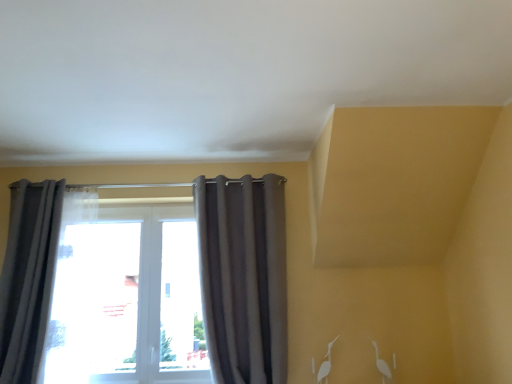
Question: Would you say matte gray curtain at center, arranged as the 1th curtain when viewed from the right, is inside or outside gray fabric curtain at left, which is counted as the second curtain, starting from the right?

Choices:
 (A) inside
 (B) outside

Answer: (B)

Question: Is matte gray curtain at center, arranged as the 1th curtain when viewed from the right, bigger or smaller than gray fabric curtain at left, which is counted as the second curtain, starting from the right?

Choices:
 (A) big
 (B) small

Answer: (B)

Question: Is matte gray curtain at center, placed as the second curtain when sorted from left to right, in front of or behind gray fabric curtain at left, which is counted as the second curtain, starting from the right, in the image?

Choices:
 (A) behind
 (B) front

Answer: (A)

Question: Is gray fabric curtain at left, which is counted as the second curtain, starting from the right, to the left or to the right of matte gray curtain at center, placed as the second curtain when sorted from left to right, in the image?

Choices:
 (A) right
 (B) left

Answer: (B)

Question: Is gray fabric curtain at left, which is counted as the second curtain, starting from the right, bigger or smaller than matte gray curtain at center, arranged as the 1th curtain when viewed from the right?

Choices:
 (A) big
 (B) small

Answer: (A)

Question: Is gray fabric curtain at left, which is counted as the 1th curtain, starting from the left, inside the boundaries of matte gray curtain at center, placed as the second curtain when sorted from left to right, or outside?

Choices:
 (A) outside
 (B) inside

Answer: (A)

Question: From their relative heights in the image, would you say gray fabric curtain at left, which is counted as the second curtain, starting from the right, is taller or shorter than matte gray curtain at center, arranged as the 1th curtain when viewed from the right?

Choices:
 (A) short
 (B) tall

Answer: (A)